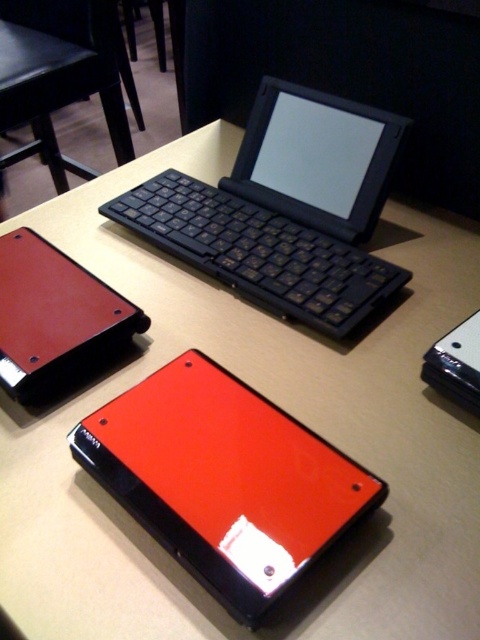
Question: Which of the following is the closest to the observer?

Choices:
 (A) black matte keyboard at center
 (B) glossy leather tablet at lower left
 (C) matte black keyboard at upper center
 (D) glossy red tablet at center

Answer: (D)

Question: Which object appears closest to the camera in this image?

Choices:
 (A) glossy red tablet at center
 (B) black matte keyboard at center
 (C) matte black keyboard at upper center

Answer: (A)

Question: Which object is the closest to the matte black keyboard at upper center?

Choices:
 (A) black matte keyboard at center
 (B) glossy red tablet at center
 (C) glossy leather tablet at lower left

Answer: (A)

Question: Is glossy leather tablet at lower left positioned in front of matte black keyboard at upper center?

Choices:
 (A) yes
 (B) no

Answer: (A)

Question: Is glossy red tablet at center below glossy leather tablet at lower left?

Choices:
 (A) no
 (B) yes

Answer: (B)

Question: Is glossy leather tablet at lower left thinner than matte black keyboard at upper center?

Choices:
 (A) no
 (B) yes

Answer: (B)